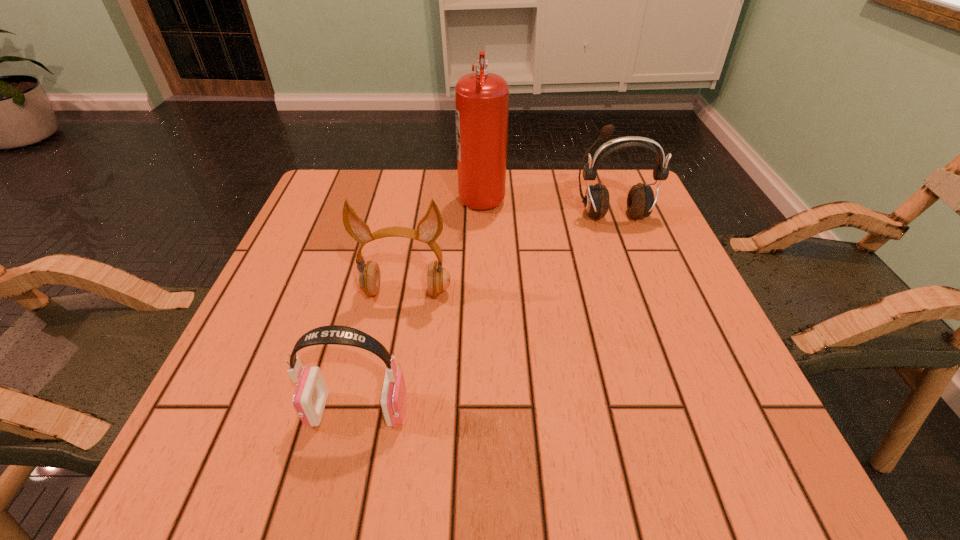
Where is `free space that satisfies the following two spatial constraints: 1. on the front-facing side of the second nearest earphone; 2. on the outer surface of the nearest object`? This screenshot has height=540, width=960. free space that satisfies the following two spatial constraints: 1. on the front-facing side of the second nearest earphone; 2. on the outer surface of the nearest object is located at coordinates point(384,410).

Find the location of a particular element. blank area in the image that satisfies the following two spatial constraints: 1. on the front-facing side of the third farthest object; 2. on the outer surface of the nearest object is located at coordinates (384, 410).

The width and height of the screenshot is (960, 540). Find the location of `vacant space that satisfies the following two spatial constraints: 1. on the front-facing side of the second farthest earphone; 2. on the outer surface of the shortest earphone`. vacant space that satisfies the following two spatial constraints: 1. on the front-facing side of the second farthest earphone; 2. on the outer surface of the shortest earphone is located at coordinates (384, 410).

The width and height of the screenshot is (960, 540). I want to click on vacant area that satisfies the following two spatial constraints: 1. on the ear pads of the rightmost object; 2. on the outer surface of the nearest earphone, so [685, 410].